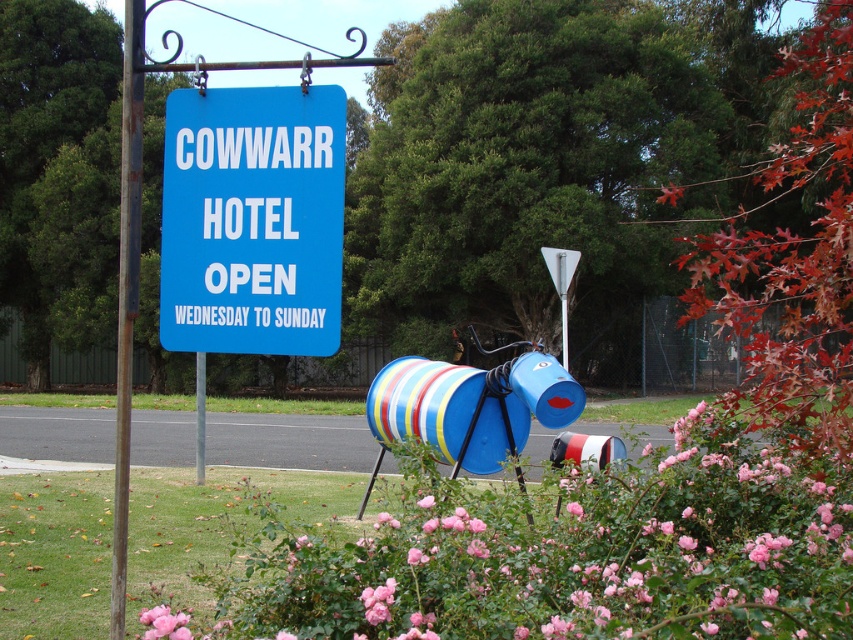
Question: Is pink matte flower at center closer to camera compared to rusty metal pole at left?

Choices:
 (A) no
 (B) yes

Answer: (B)

Question: Is blue plastic sign at upper center positioned behind rusty metal pole at left?

Choices:
 (A) yes
 (B) no

Answer: (B)

Question: Which point appears farthest from the camera in this image?

Choices:
 (A) (202, 273)
 (B) (761, 548)

Answer: (A)

Question: Does pink matte flower at center have a larger size compared to blue plastic sign at upper center?

Choices:
 (A) yes
 (B) no

Answer: (A)

Question: Which point is closer to the camera?

Choices:
 (A) (306, 131)
 (B) (691, 468)

Answer: (A)

Question: Among these points, which one is farthest from the camera?

Choices:
 (A) (538, 500)
 (B) (141, 52)
 (C) (256, 273)

Answer: (A)